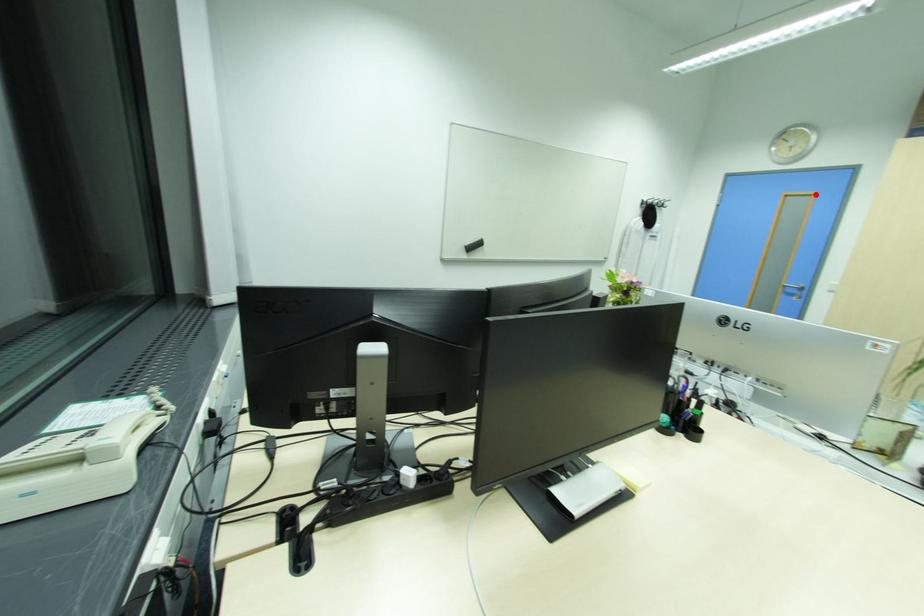
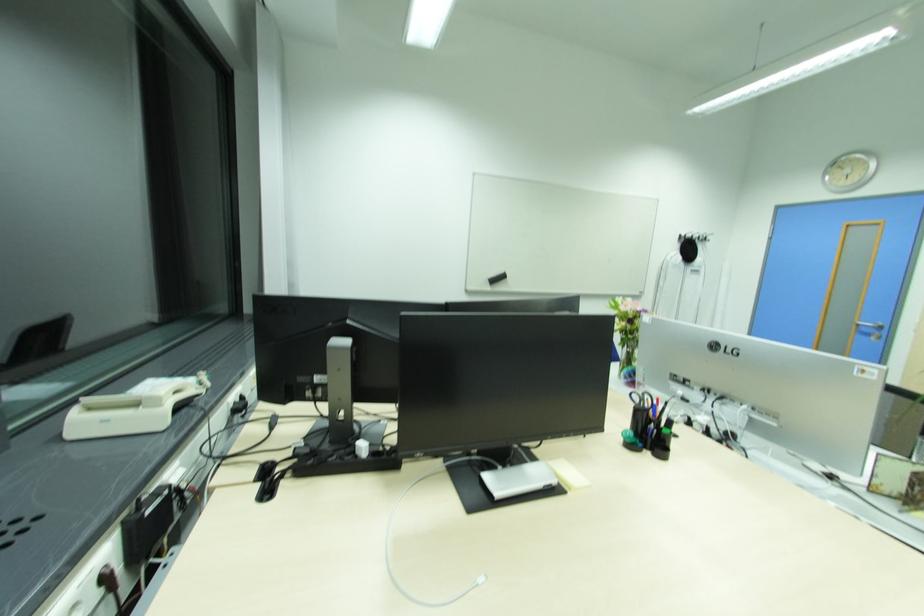
The point at the highlighted location is marked in the first image. Where is the corresponding point in the second image?

(882, 224)